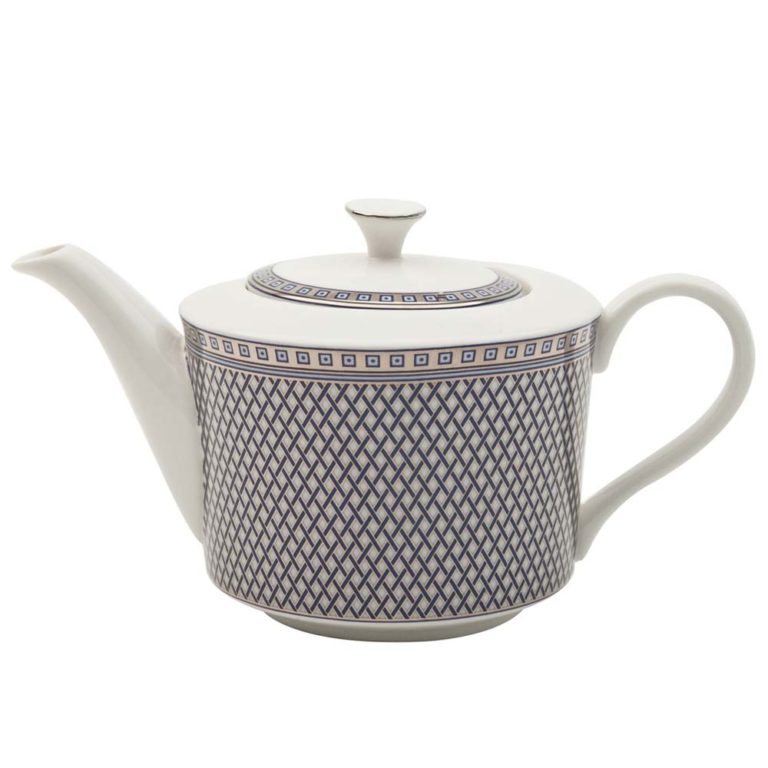
Where is `bottom lip of teapot`? The height and width of the screenshot is (768, 768). bottom lip of teapot is located at coordinates pos(412,639).